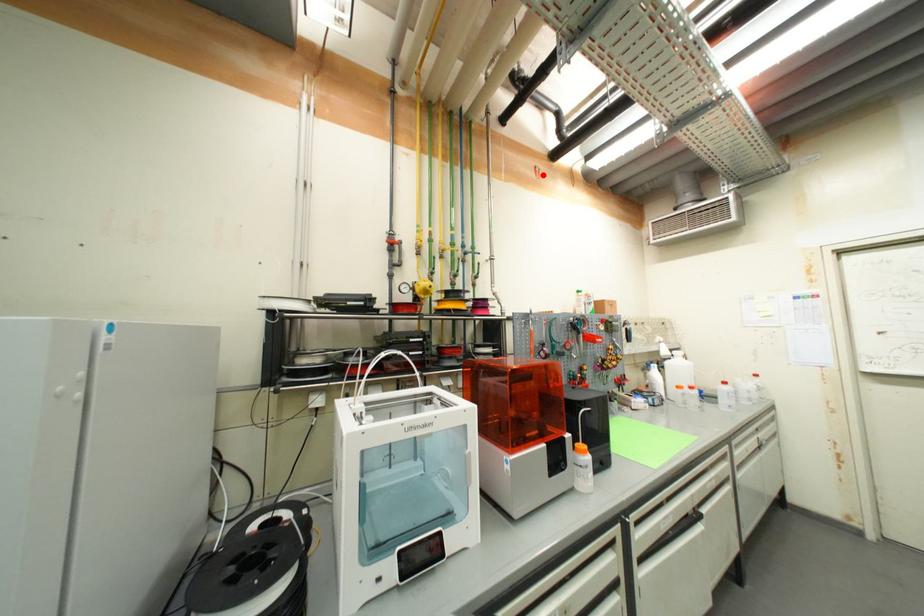
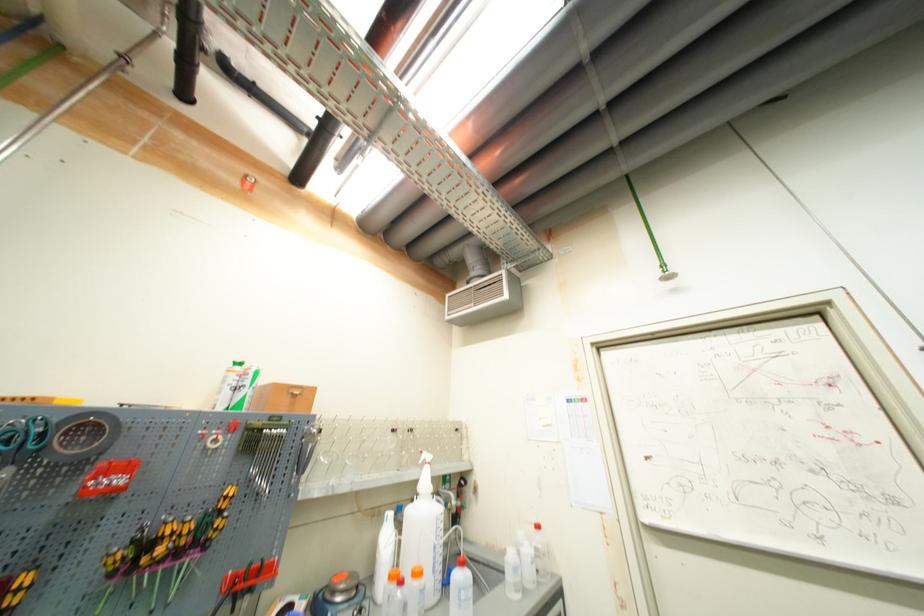
Question: I am providing you with two images of the same scene from different viewpoints. A red point is marked on the first image. Can you still see the location of the red point in image 2?

Choices:
 (A) Yes
 (B) No

Answer: (A)